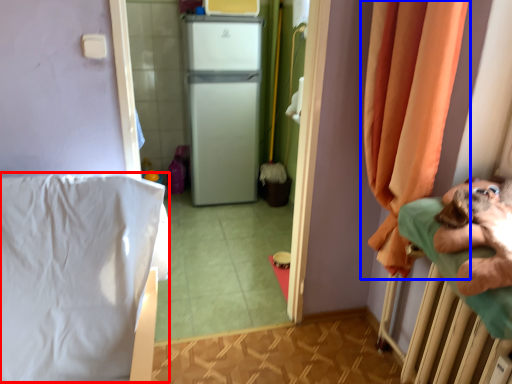
Question: Which of the following is the closest to the observer, sheet (highlighted by a red box) or curtain (highlighted by a blue box)?

Choices:
 (A) sheet
 (B) curtain

Answer: (A)